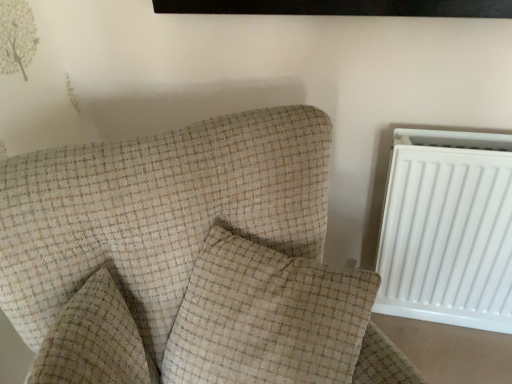
Question: From a real-world perspective, relative to beige checkered pillow at center, which is counted as the first pillow, starting from the left, is beige textured pillow at center, which appears as the 2th pillow when viewed from the left, vertically above or below?

Choices:
 (A) above
 (B) below

Answer: (A)

Question: Does point (198, 319) appear closer or farther from the camera than point (141, 372)?

Choices:
 (A) closer
 (B) farther

Answer: (B)

Question: Which object is positioned closest to the white plastic radiator at right?

Choices:
 (A) beige checkered armchair at center-left
 (B) beige checkered pillow at center, acting as the 2th pillow starting from the right
 (C) beige textured pillow at center, which appears as the 1th pillow when viewed from the right

Answer: (C)

Question: Estimate the real-world distances between objects in this image. Which object is farther from the beige textured pillow at center, which appears as the 1th pillow when viewed from the right?

Choices:
 (A) beige checkered pillow at center, acting as the 2th pillow starting from the right
 (B) white plastic radiator at right
 (C) beige checkered armchair at center-left

Answer: (B)